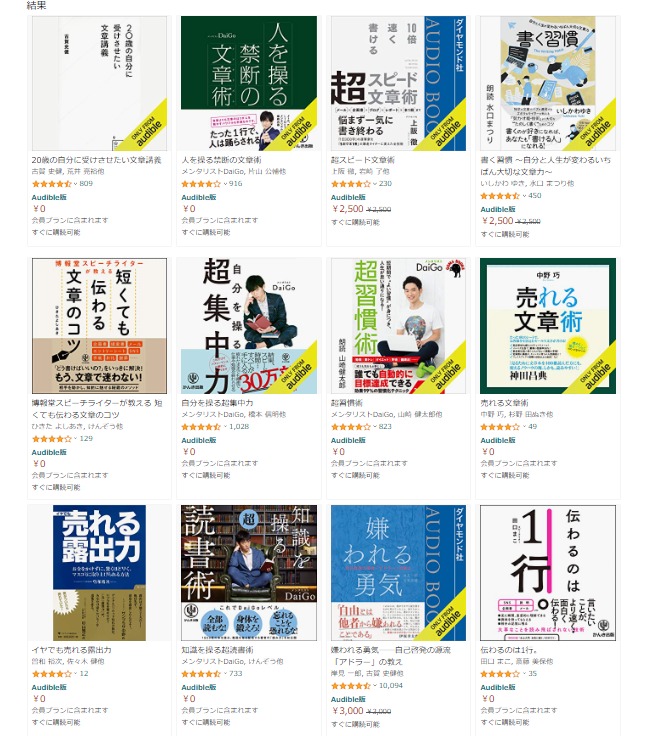
This screenshot has width=661, height=736. What are the coordinates of `poster` in the screenshot? It's located at (241, 43).